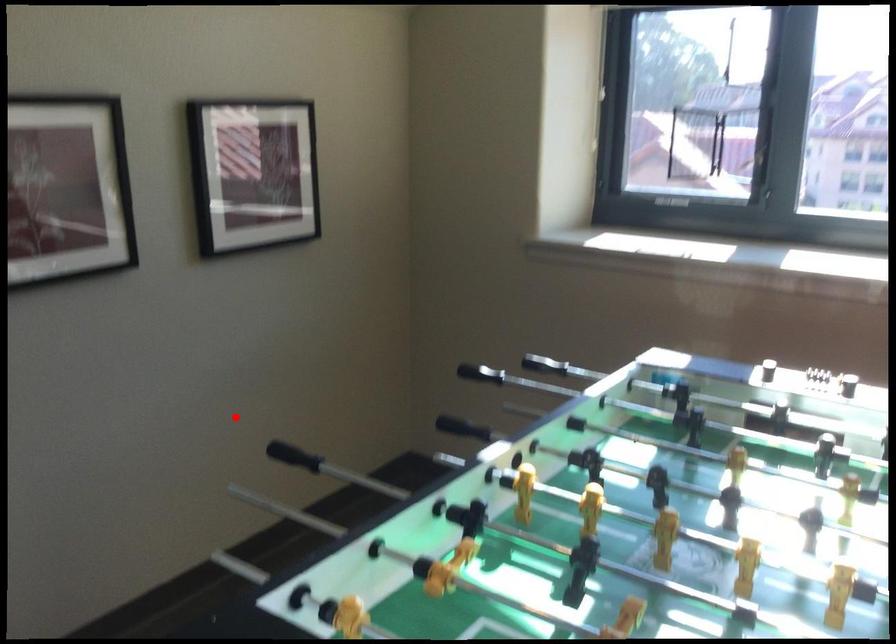
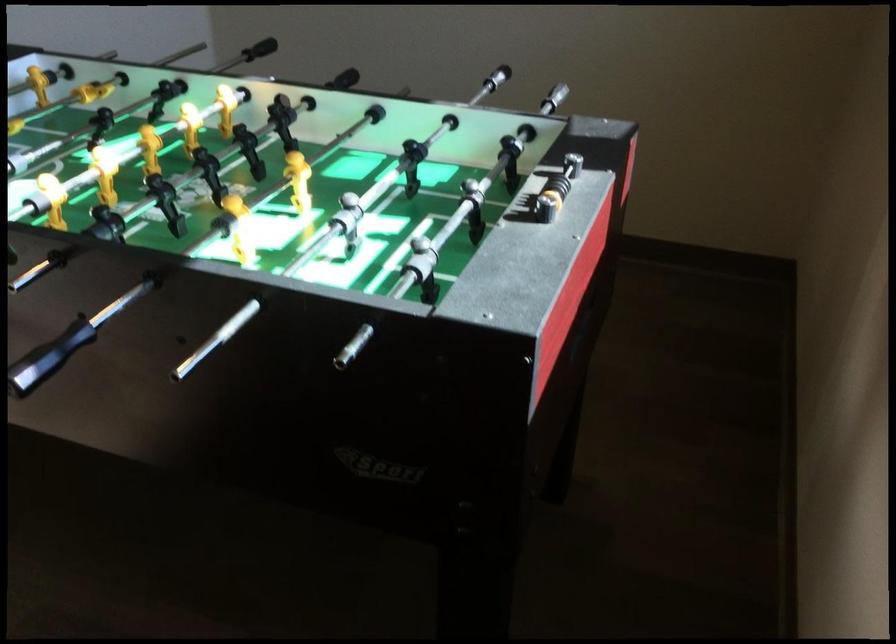
Locate, in the second image, the point that corresponds to the highlighted location in the first image.

(554, 98)